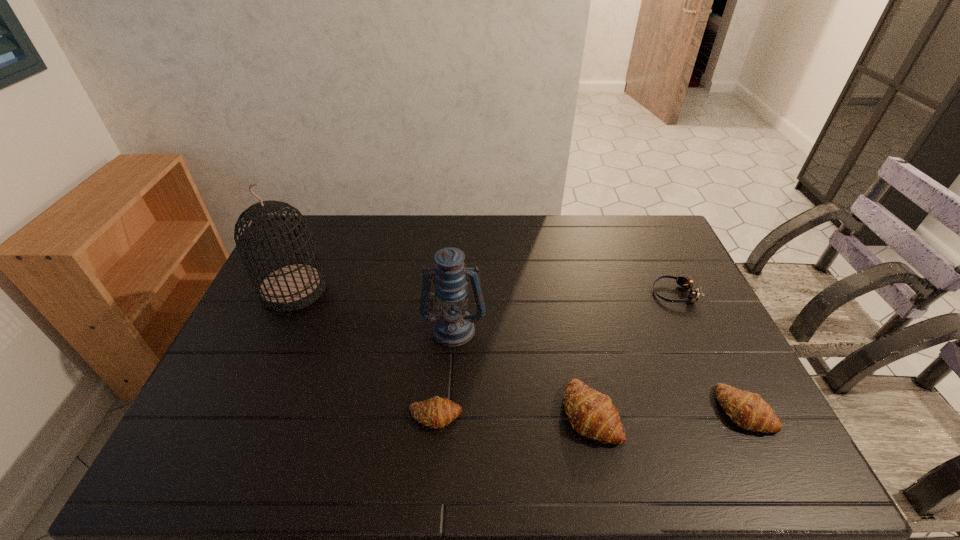
Locate an element on the screen. The image size is (960, 540). vacant space located 0.270m on the back of the second crescent roll from left to right is located at coordinates (568, 308).

At what (x,y) coordinates should I click in order to perform the action: click on vacant position located on the back of the rightmost crescent roll. Please return your answer as a coordinate pair (x, y). Looking at the image, I should click on (714, 349).

Where is `blank space located on the right of the tallest object`? The image size is (960, 540). blank space located on the right of the tallest object is located at coordinates 375,289.

Identify the location of vacant space located on the front-facing side of the lantern. This screenshot has width=960, height=540. [x=451, y=376].

What are the coordinates of `free space located through the lenses of the goggles` in the screenshot? It's located at (602, 293).

Where is `free space located through the lenses of the goggles`? free space located through the lenses of the goggles is located at coordinates (527, 293).

Locate an element on the screen. free space located through the lenses of the goggles is located at coordinates (536, 293).

Find the location of a particular element. object that is at the left edge is located at coordinates (292, 286).

Locate an element on the screen. This screenshot has height=540, width=960. crescent roll at the right edge is located at coordinates (748, 410).

Find the location of a particular element. This screenshot has height=540, width=960. goggles at the right edge is located at coordinates click(x=686, y=283).